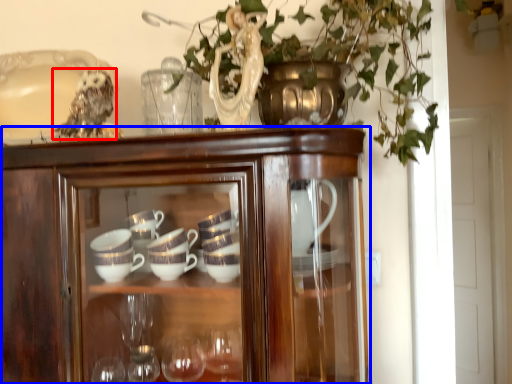
Question: Which of the following is the closest to the observer, owl (highlighted by a red box) or cupboard (highlighted by a blue box)?

Choices:
 (A) owl
 (B) cupboard

Answer: (B)